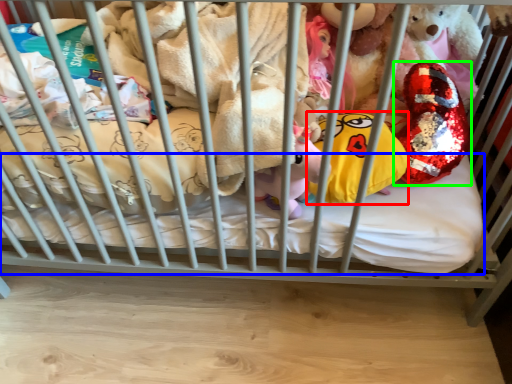
Question: Which object is the closest to the pillow (highlighted by a red box)? Choose among these: mattress (highlighted by a blue box) or toy (highlighted by a green box).

Choices:
 (A) mattress
 (B) toy

Answer: (B)